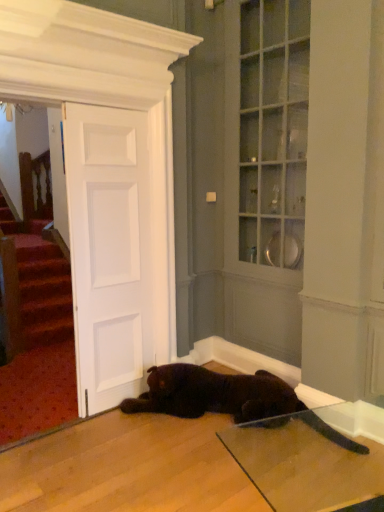
Question: Is shiny black cat at lower center at the left side of white matte door at center?

Choices:
 (A) yes
 (B) no

Answer: (B)

Question: Is shiny black cat at lower center positioned before white matte door at center?

Choices:
 (A) no
 (B) yes

Answer: (B)

Question: Can you confirm if shiny black cat at lower center is wider than white matte door at center?

Choices:
 (A) no
 (B) yes

Answer: (B)

Question: Considering the relative sizes of shiny black cat at lower center and white matte door at center in the image provided, is shiny black cat at lower center shorter than white matte door at center?

Choices:
 (A) no
 (B) yes

Answer: (B)

Question: Does shiny black cat at lower center have a lesser width compared to white matte door at center?

Choices:
 (A) no
 (B) yes

Answer: (A)

Question: From a real-world perspective, is shiny black cat at lower center positioned over white matte door at center based on gravity?

Choices:
 (A) no
 (B) yes

Answer: (A)

Question: Is white matte door at center with shiny black cat at lower center?

Choices:
 (A) no
 (B) yes

Answer: (A)

Question: Can you confirm if white matte door at center is positioned to the right of shiny black cat at lower center?

Choices:
 (A) no
 (B) yes

Answer: (A)

Question: Does white matte door at center have a lesser height compared to shiny black cat at lower center?

Choices:
 (A) no
 (B) yes

Answer: (A)

Question: Does white matte door at center have a lesser width compared to shiny black cat at lower center?

Choices:
 (A) no
 (B) yes

Answer: (B)

Question: Is white matte door at center oriented towards shiny black cat at lower center?

Choices:
 (A) yes
 (B) no

Answer: (B)

Question: Is white matte door at center positioned behind shiny black cat at lower center?

Choices:
 (A) yes
 (B) no

Answer: (A)

Question: Is shiny black cat at lower center wider or thinner than white matte door at center?

Choices:
 (A) wide
 (B) thin

Answer: (A)